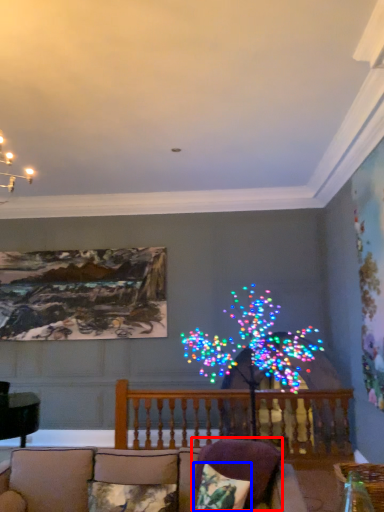
Question: Which of the following is the farthest to the observer, pillow (highlighted by a red box) or pillow (highlighted by a blue box)?

Choices:
 (A) pillow
 (B) pillow

Answer: (A)